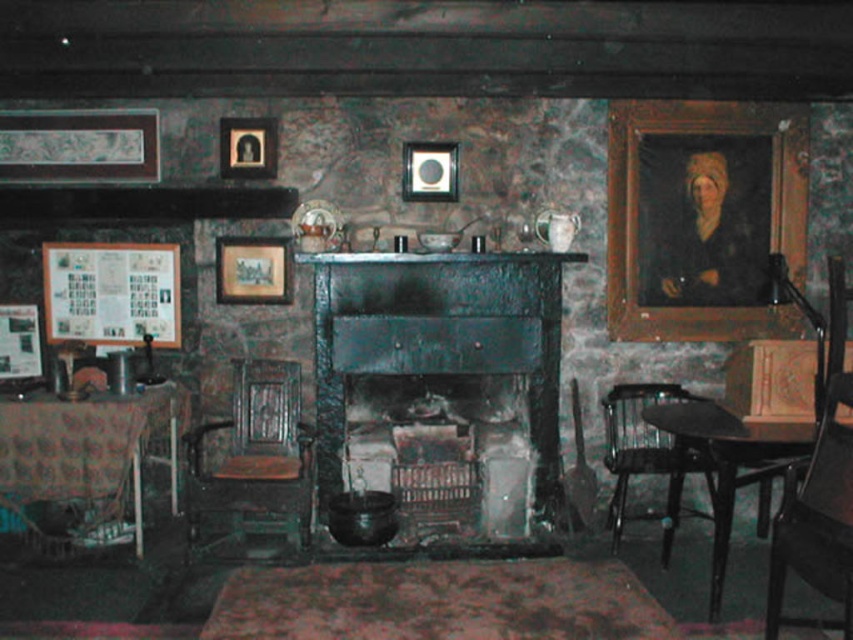
You are an interior designer planning to place a new rug in this rustic room. The wooden portrait at right and the wooden chair at right are both on the right side of the room. Which object should you consider when ensuring the rug is large enough to accommodate both?

The wooden chair at right is larger than the wooden portrait at right, so you should consider the size of the wooden chair at right to ensure the rug is large enough to accommodate both.